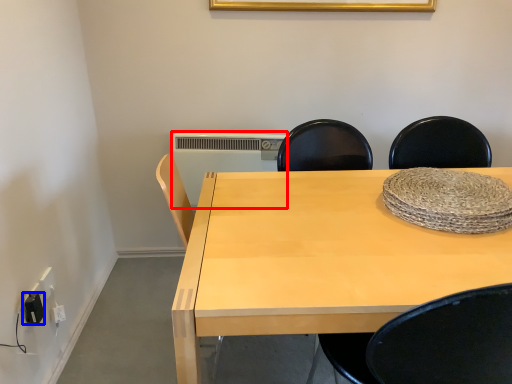
Question: Among these objects, which one is farthest to the camera, radiator (highlighted by a red box) or electric outlet (highlighted by a blue box)?

Choices:
 (A) radiator
 (B) electric outlet

Answer: (A)